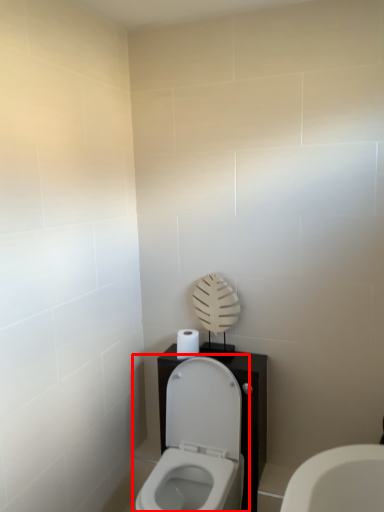
Question: From the image's perspective, considering the relative positions of toilet (annotated by the red box) and toilet paper in the image provided, where is toilet (annotated by the red box) located with respect to the staircase?

Choices:
 (A) below
 (B) above

Answer: (A)